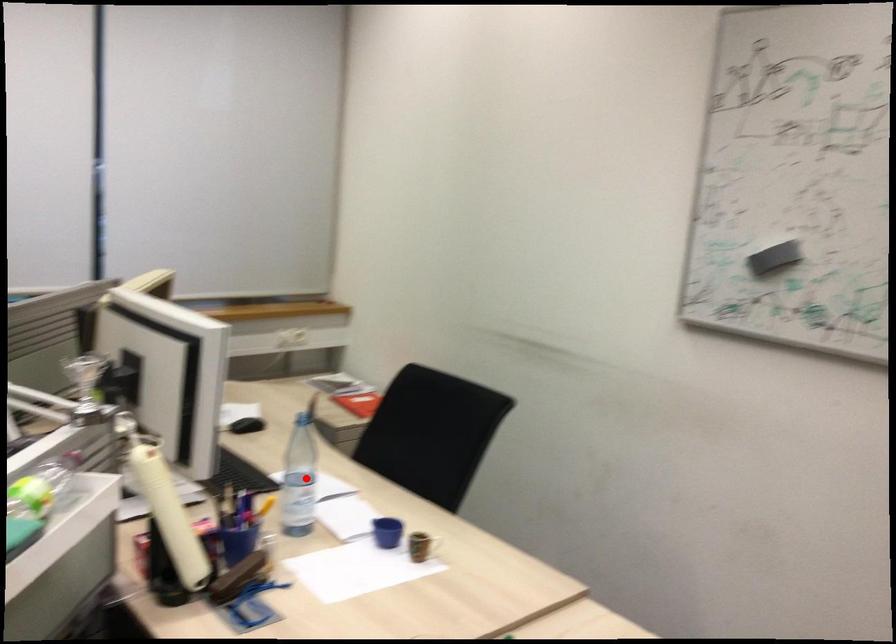
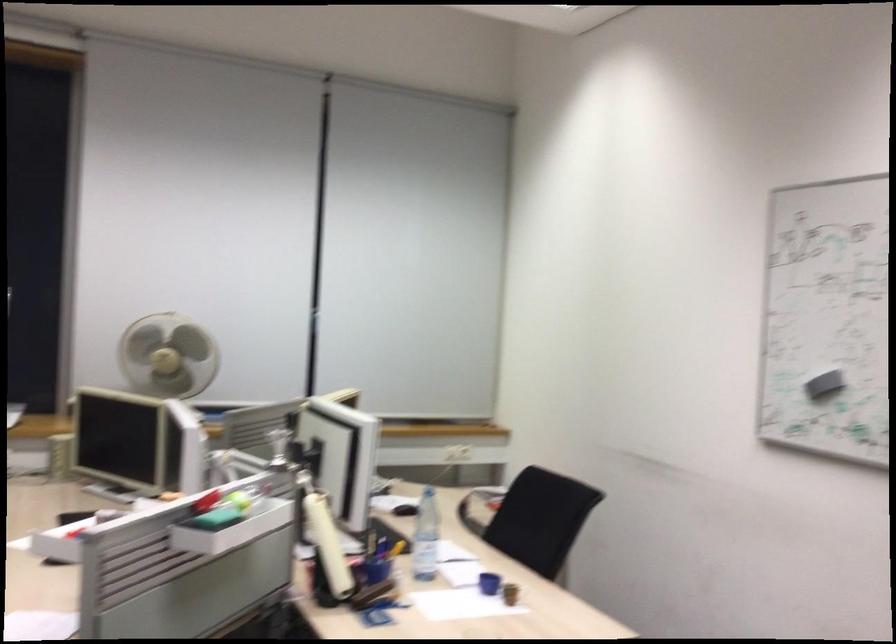
Question: I am providing you with two images of the same scene from different viewpoints. Image1 has a red point marked. In image2, the corresponding 3D location appears at what relative position? Reply with the corresponding letter.

Choices:
 (A) Closer
 (B) Farther

Answer: (B)